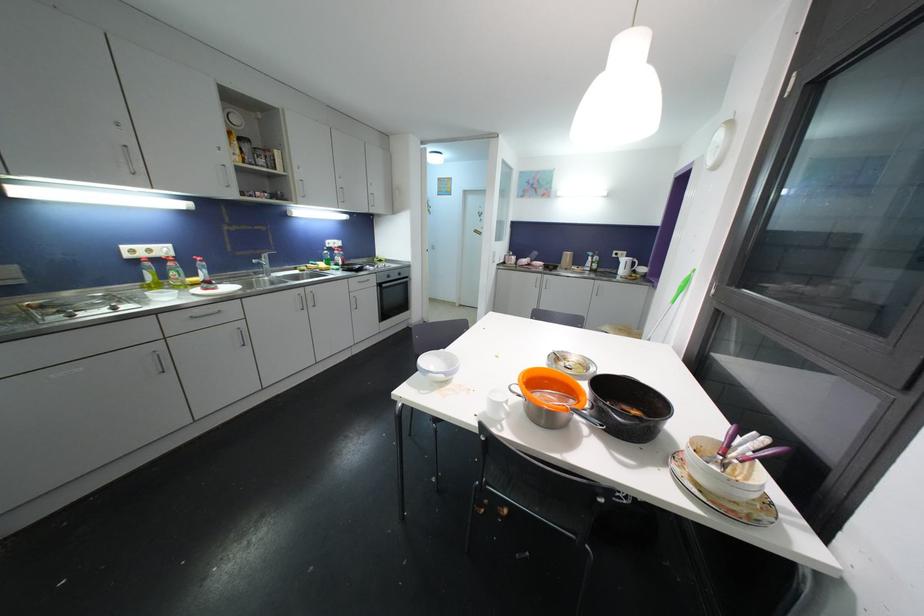
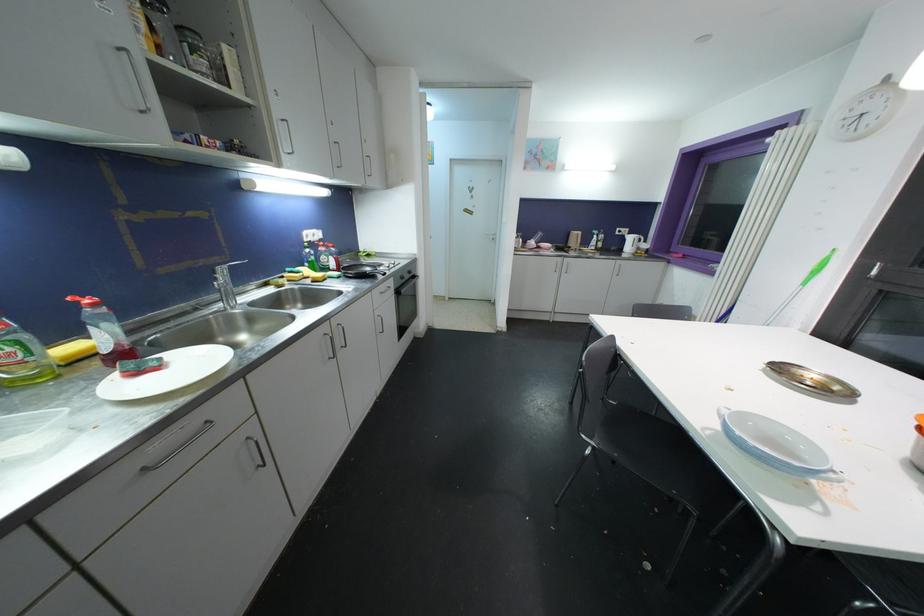
The point at (x=383, y=288) is marked in the first image. Where is the corresponding point in the second image?

(400, 294)